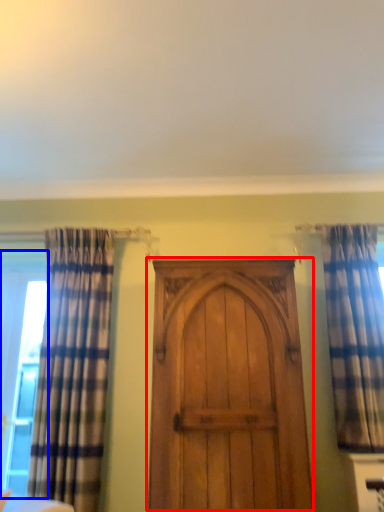
Question: Which object is further to the camera taking this photo, door (highlighted by a red box) or window (highlighted by a blue box)?

Choices:
 (A) door
 (B) window

Answer: (B)